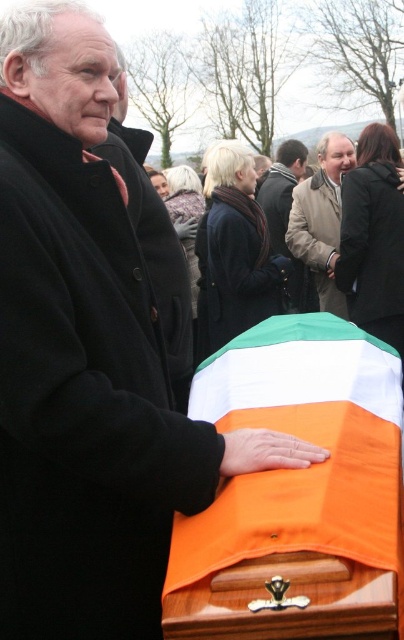
Question: Estimate the real-world distances between objects in this image. Which object is closer to the beige wool coat at center?

Choices:
 (A) orange fabric flag at lower center
 (B) dark brown leather jacket at center

Answer: (B)

Question: Does orange fabric flag at lower center have a smaller size compared to beige wool coat at center?

Choices:
 (A) yes
 (B) no

Answer: (B)

Question: Estimate the real-world distances between objects in this image. Which object is farther from the dark brown leather jacket at center?

Choices:
 (A) beige wool coat at center
 (B) orange fabric flag at lower center

Answer: (B)

Question: Which point is farther from the camera taking this photo?

Choices:
 (A) (281, 429)
 (B) (269, 204)
 (C) (338, 164)

Answer: (B)

Question: Observing the image, what is the correct spatial positioning of beige wool coat at center in reference to dark brown leather jacket at center?

Choices:
 (A) left
 (B) right

Answer: (B)

Question: Can you confirm if beige wool coat at center is positioned below dark brown leather jacket at center?

Choices:
 (A) no
 (B) yes

Answer: (B)